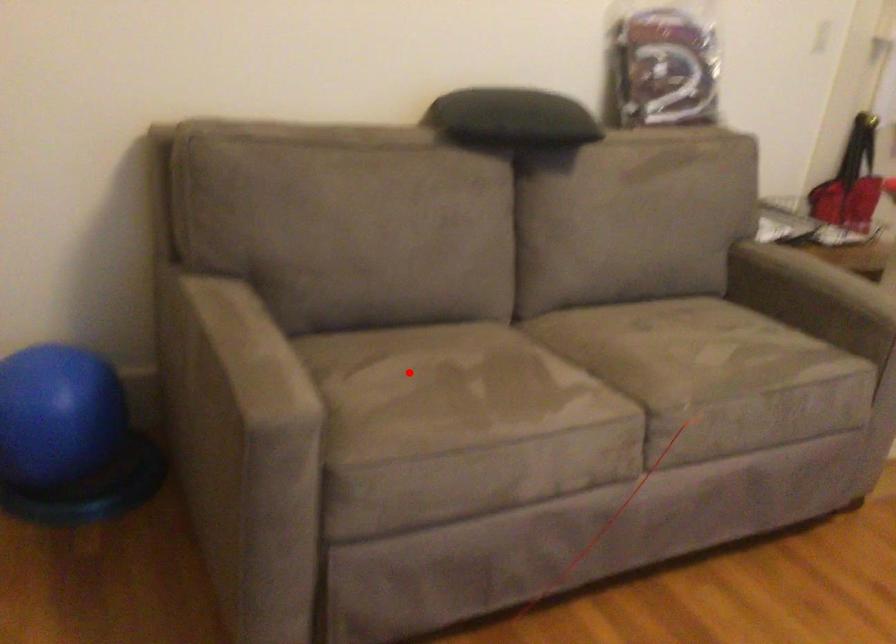
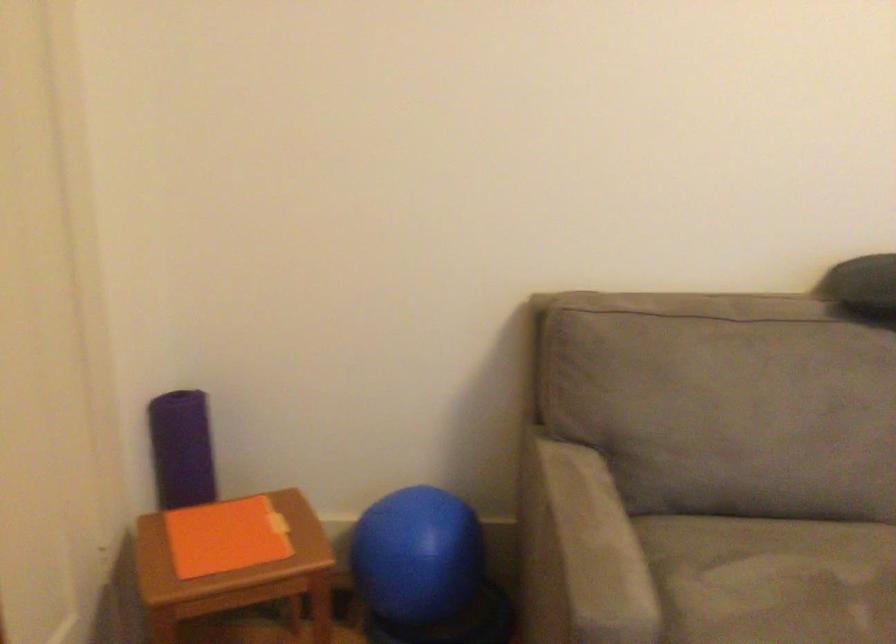
Question: I am providing you with two images of the same scene from different viewpoints. Image1 has a red point marked. In image2, the corresponding 3D location appears at what relative position? Reply with the corresponding letter.

Choices:
 (A) Closer
 (B) Farther

Answer: (A)